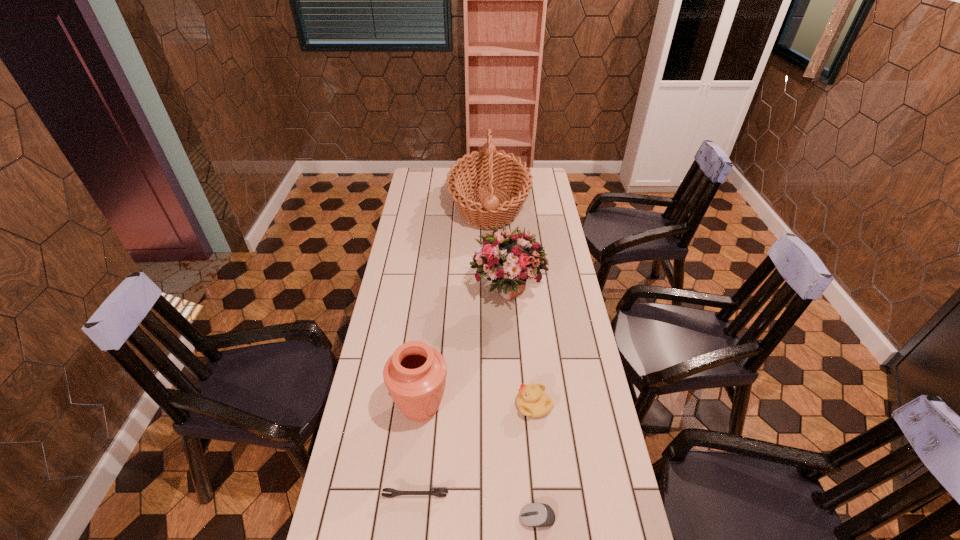
You are a GUI agent. You are given a task and a screenshot of the screen. Output one action in this format:
    pyautogui.click(x=<x>, y=<y>)
    Task: Click on the farthest object
    The height and width of the screenshot is (540, 960).
    Given the screenshot: What is the action you would take?
    pyautogui.click(x=490, y=167)

This screenshot has width=960, height=540. I want to click on basket, so pyautogui.click(x=490, y=167).

At what (x,y) coordinates should I click in order to perform the action: click on the second farthest object. Please return your answer as a coordinate pair (x, y). Looking at the image, I should click on (508, 258).

Where is `vase`? This screenshot has height=540, width=960. vase is located at coordinates (415, 374).

The width and height of the screenshot is (960, 540). In order to click on duckling in this screenshot , I will do `click(532, 401)`.

Locate an element on the screen. wrench is located at coordinates (439, 492).

The width and height of the screenshot is (960, 540). I want to click on the fifth farthest object, so click(439, 492).

Where is `computer equipment`? computer equipment is located at coordinates (535, 514).

You are a GUI agent. You are given a task and a screenshot of the screen. Output one action in this format:
    pyautogui.click(x=<x>, y=<y>)
    Task: Click on the nearest object
    Image resolution: width=960 pixels, height=540 pixels.
    Given the screenshot: What is the action you would take?
    pyautogui.click(x=535, y=514)

Locate an element on the screen. Image resolution: width=960 pixels, height=540 pixels. blank space located 0.390m on the front of the basket is located at coordinates (492, 303).